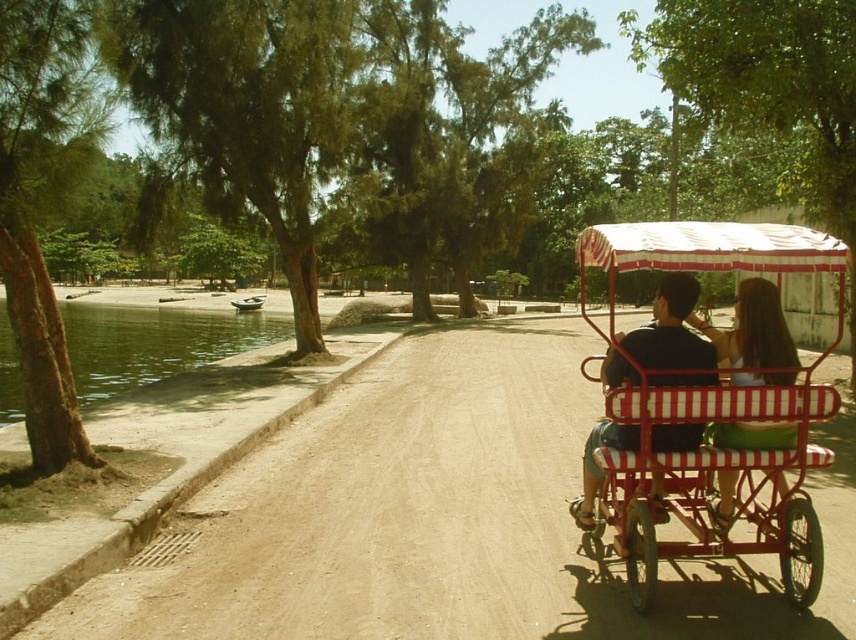
Question: Does matte black shirt at center appear over matte white dress at center?

Choices:
 (A) yes
 (B) no

Answer: (B)

Question: Which point is closer to the camera taking this photo?

Choices:
 (A) click(741, 291)
 (B) click(595, 637)
 (C) click(700, 364)

Answer: (B)

Question: Which point is closer to the camera?

Choices:
 (A) (276, 314)
 (B) (753, 353)

Answer: (B)

Question: In this image, where is brown dirt track at center located relative to red striped cart at right?

Choices:
 (A) right
 (B) left

Answer: (B)

Question: Does red striped cart at right have a greater width compared to matte black shirt at center?

Choices:
 (A) no
 (B) yes

Answer: (B)

Question: Considering the real-world distances, which object is closest to the red striped cart at right?

Choices:
 (A) matte white dress at center
 (B) matte black shirt at center

Answer: (B)